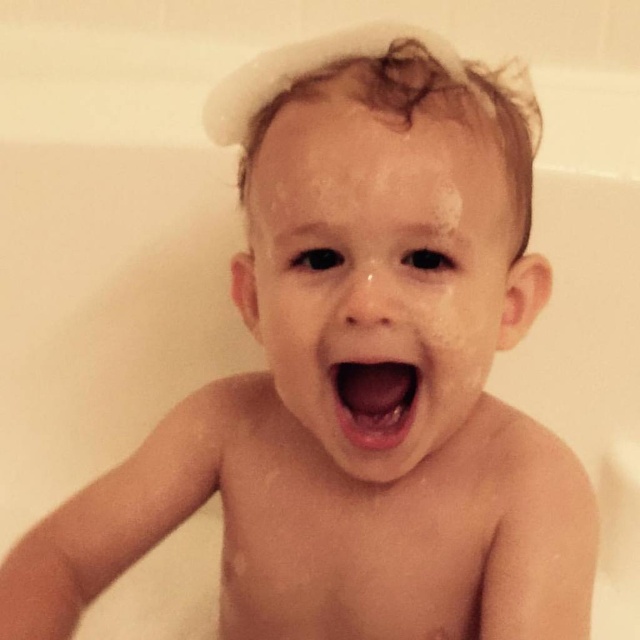
Can you confirm if wet skin face at center is positioned to the right of pink glossy lips at center?

In fact, wet skin face at center is to the left of pink glossy lips at center.

Is point (328, 440) farther from camera compared to point (394, 445)?

Yes, point (328, 440) is behind point (394, 445).

This screenshot has width=640, height=640. I want to click on wet skin face at center, so click(376, 276).